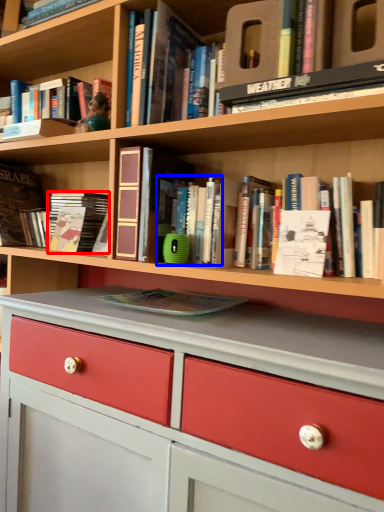
Question: Which object appears closest to the camera in this image, book (highlighted by a red box) or book (highlighted by a blue box)?

Choices:
 (A) book
 (B) book

Answer: (B)